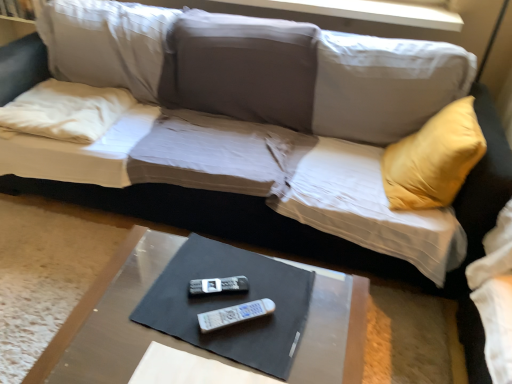
The image size is (512, 384). What are the coordinates of `free area in between white plastic remote at center, the first remote ordered from the bottom, and black plastic remote at center, the second remote when ordered from bottom to top` in the screenshot? It's located at click(x=221, y=301).